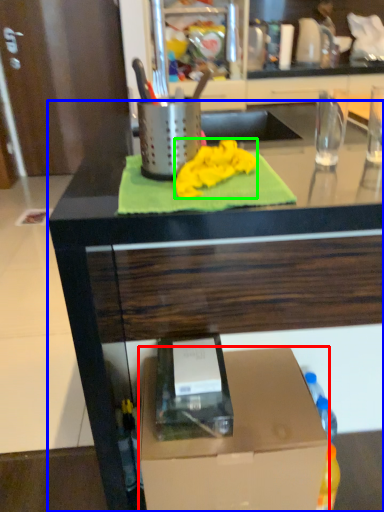
Question: Which object is positioned closest to box (highlighted by a red box)? Select from countertop (highlighted by a blue box) and cloth (highlighted by a green box).

Choices:
 (A) countertop
 (B) cloth

Answer: (A)